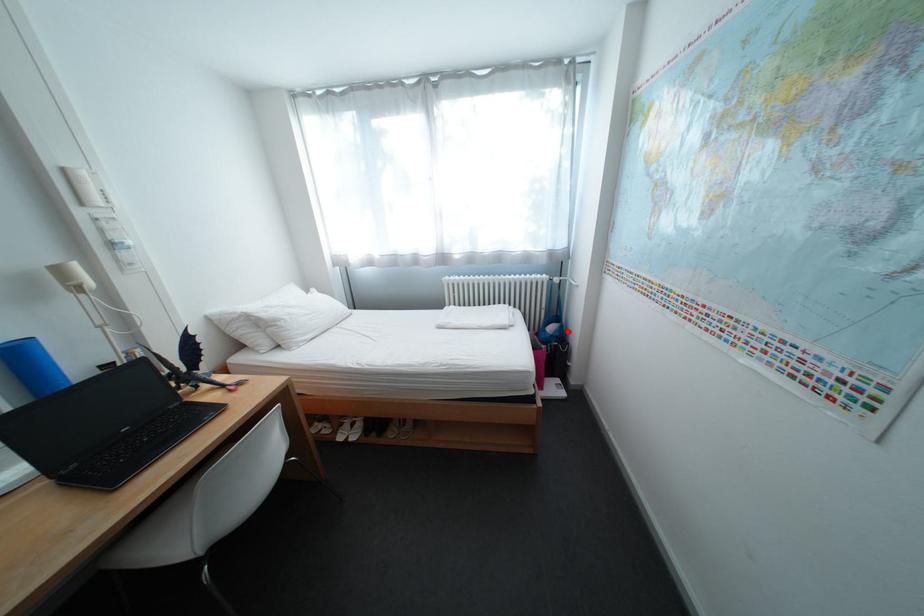
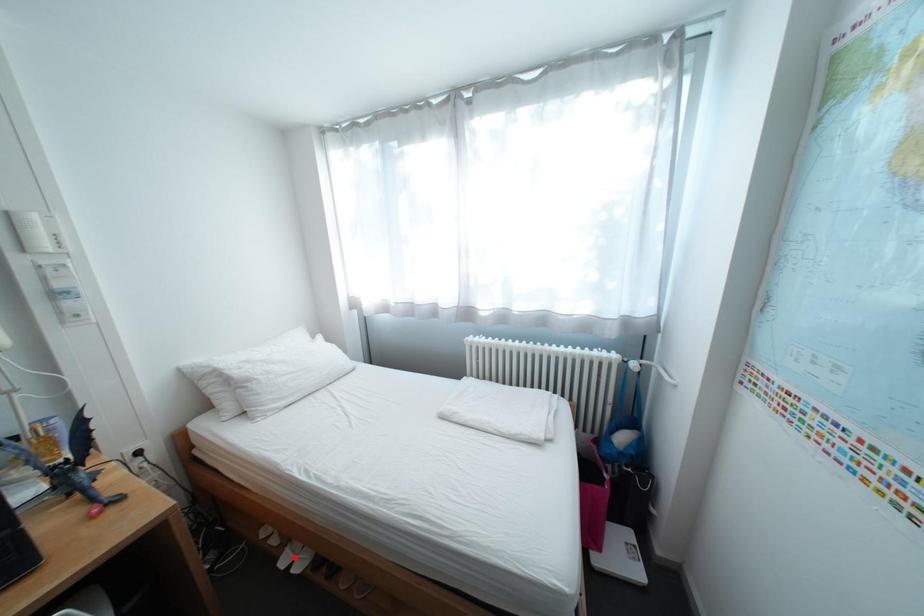
I am providing you with two images of the same scene from different viewpoints. A red point is marked on the first image and another point is marked on the second image. Is the red point in image1 aligned with the point shown in image2?

No